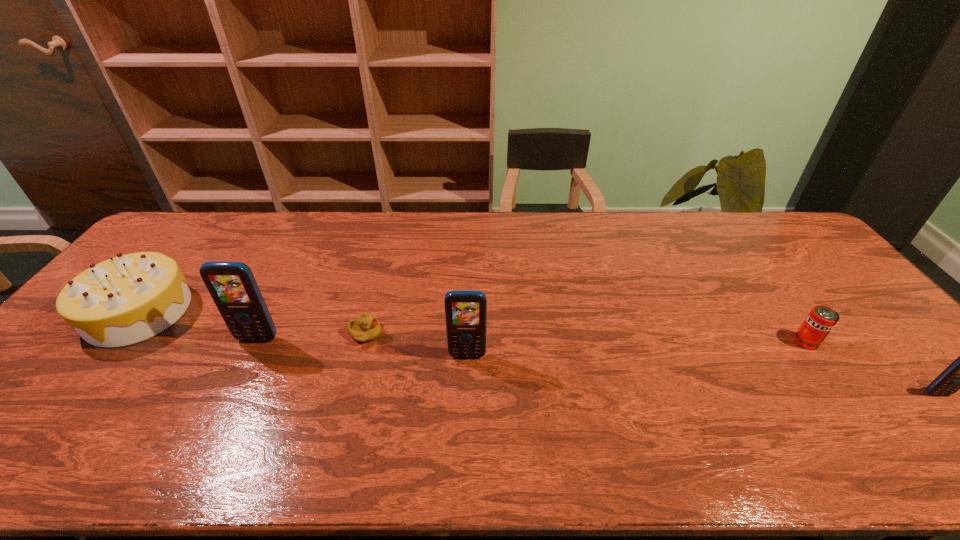
Locate an element on the screen. The image size is (960, 540). the leftmost cellular telephone is located at coordinates (232, 286).

This screenshot has width=960, height=540. Find the location of `the farthest cellular telephone`. the farthest cellular telephone is located at coordinates (232, 286).

The image size is (960, 540). What are the coordinates of `the second shortest cellular telephone` in the screenshot? It's located at (465, 310).

Locate an element on the screen. the third object from right to left is located at coordinates (465, 310).

In order to click on the rightmost cellular telephone in this screenshot , I will do `click(959, 375)`.

Find the location of `the nearest object`. the nearest object is located at coordinates (959, 375).

This screenshot has width=960, height=540. In order to click on the fifth object from left to right in this screenshot , I will do `click(821, 319)`.

In order to click on can in this screenshot , I will do `click(821, 319)`.

Locate an element on the screen. This screenshot has height=540, width=960. duckling is located at coordinates (366, 327).

Locate an element on the screen. the fourth object from right to left is located at coordinates (366, 327).